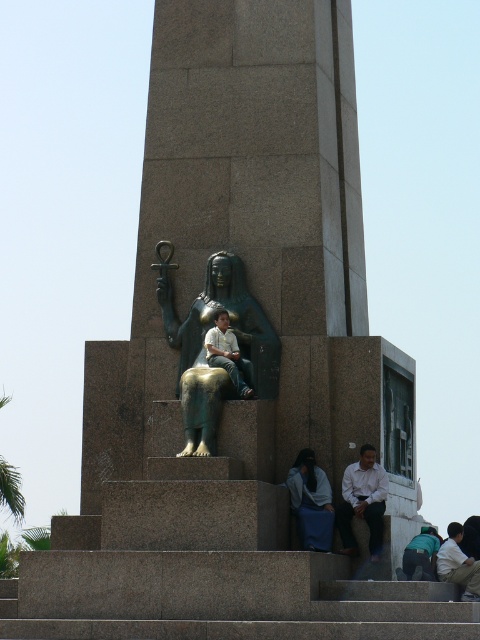
You are standing at the base of the monument and want to reach the top. You notice two points marked on the monument. The first point is at coordinates point (375, 497) and the second is at point (479, 596). Which point should you aim for if you want to reach the highest part of the monument?

Point (479, 596) is higher than point (375, 497) because it has a larger y coordinate value, so you should aim for point (479, 596) to reach the highest part of the monument.

You are an archaeologist examining the monument and notice the bronze statue at center and the light brown fabric jacket at lower right. Which object has a smaller width when viewed from the front?

The bronze statue at center is thinner than the light brown fabric jacket at lower right, so the bronze statue at center has a smaller width when viewed from the front.

You are standing at the base of the monument and notice a white shirt at lower right and a light brown fabric jacket at lower right. If you want to pick up both items, which one should you move towards first if you are currently facing the monument?

Since the white shirt at lower right and light brown fabric jacket at lower right are 5.68 meters apart, you should move towards the one closer to your current position. However, the exact distance from you to each item isn